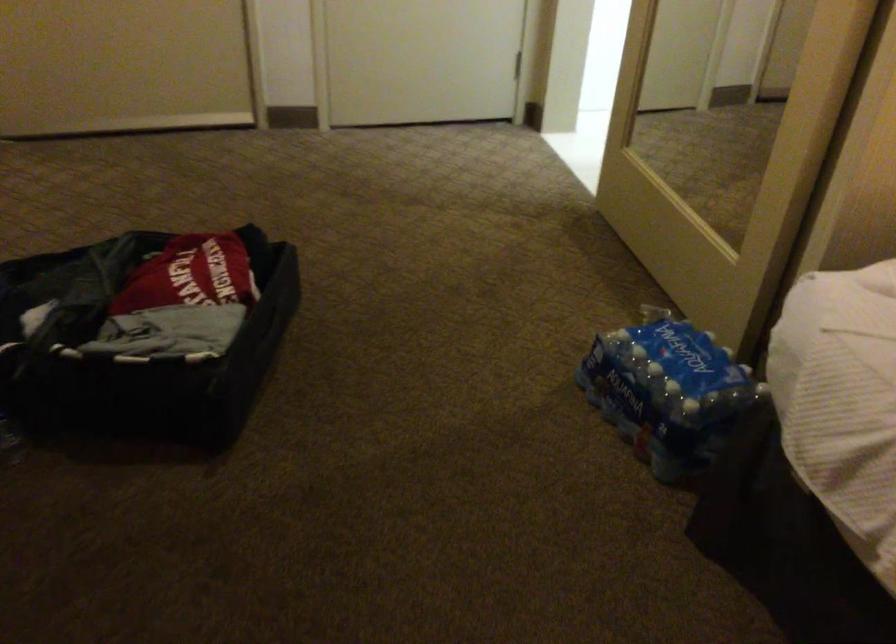
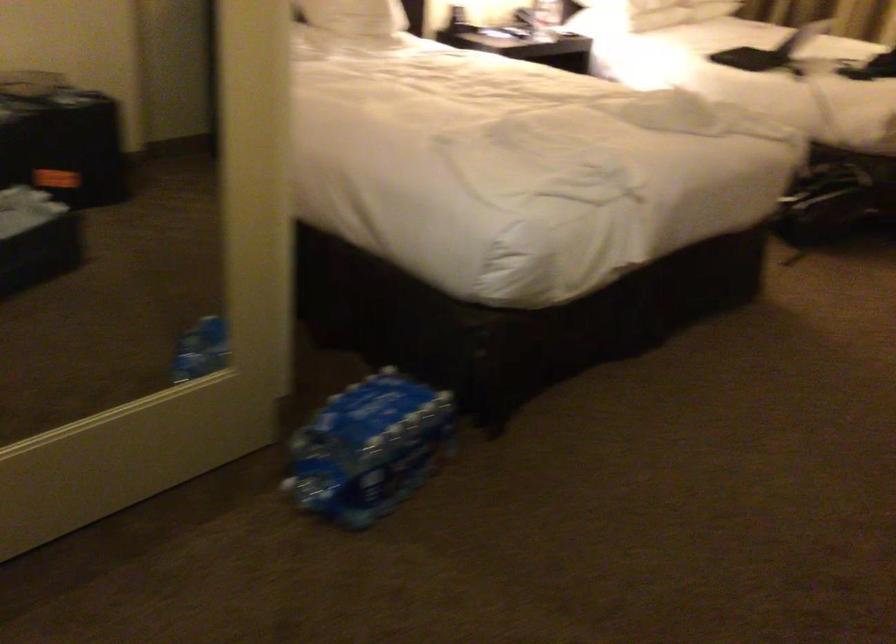
In the second image, find the point that corresponds to pixel 621 332 in the first image.

(367, 448)